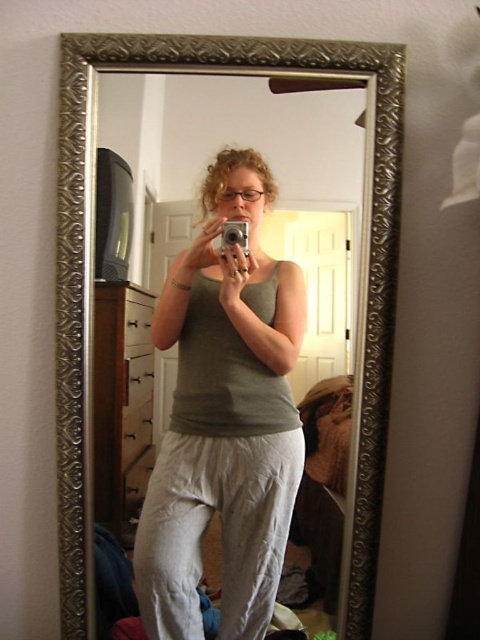
Question: Is gray cotton tank top at center in front of silver metallic mirror at center?

Choices:
 (A) yes
 (B) no

Answer: (B)

Question: Can you confirm if gray cotton tank top at center is wider than silver metallic mirror at center?

Choices:
 (A) yes
 (B) no

Answer: (B)

Question: Which of the following is the farthest from the observer?

Choices:
 (A) (272, 589)
 (B) (84, 360)

Answer: (A)

Question: Is gray cotton tank top at center to the right of silver metallic mirror at center from the viewer's perspective?

Choices:
 (A) no
 (B) yes

Answer: (B)